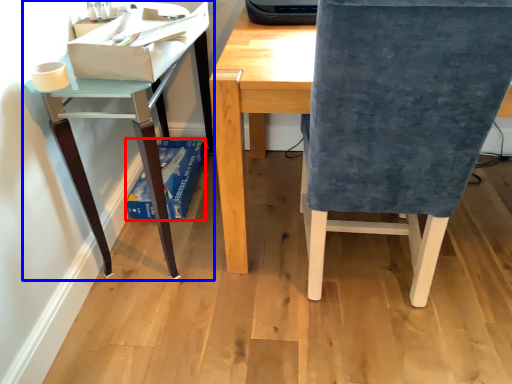
Question: Which object is further to the camera taking this photo, paperback book (highlighted by a red box) or table (highlighted by a blue box)?

Choices:
 (A) paperback book
 (B) table

Answer: (A)